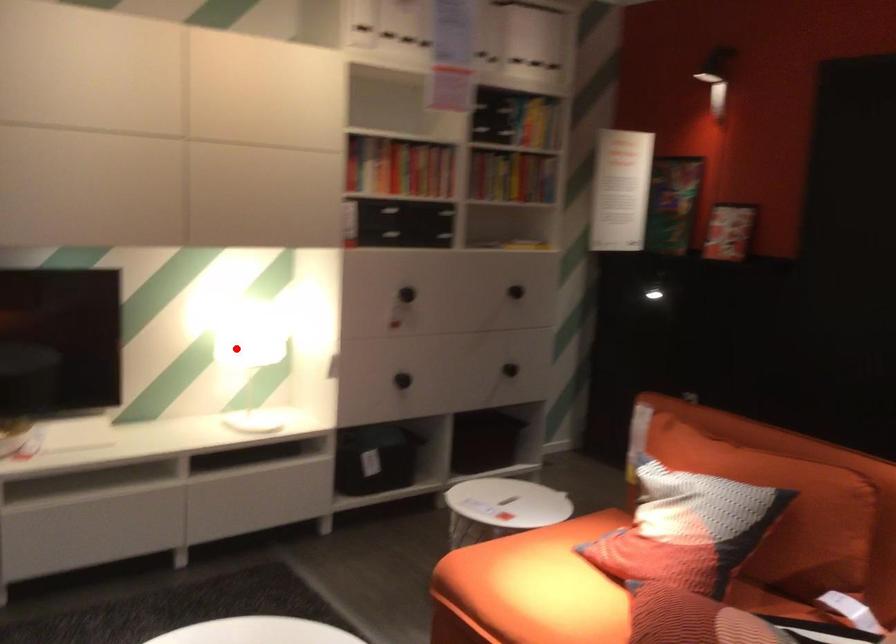
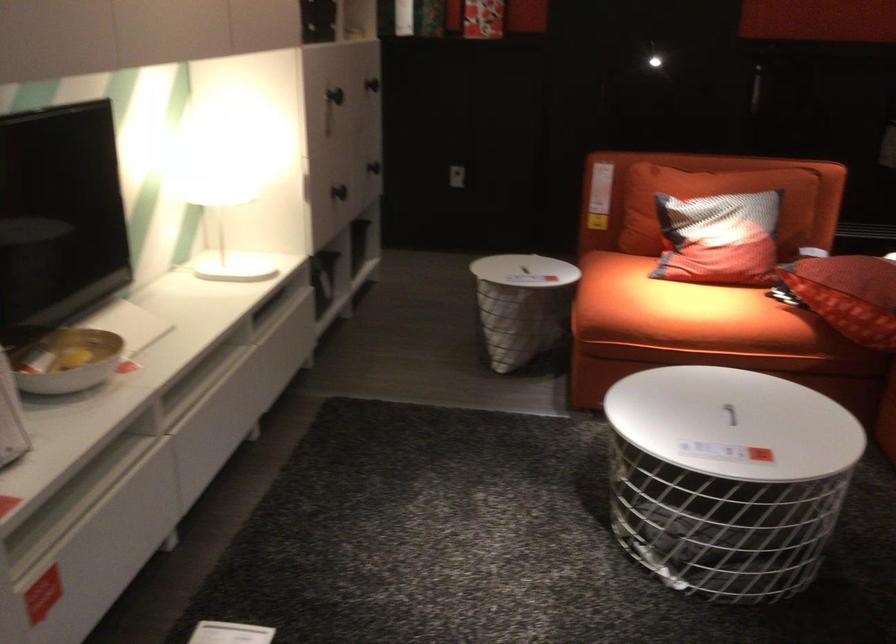
Question: I am providing you with two images of the same scene from different viewpoints. A red point is marked on the first image. Is the red point's position out of view in image 2?

Choices:
 (A) Yes
 (B) No

Answer: (B)